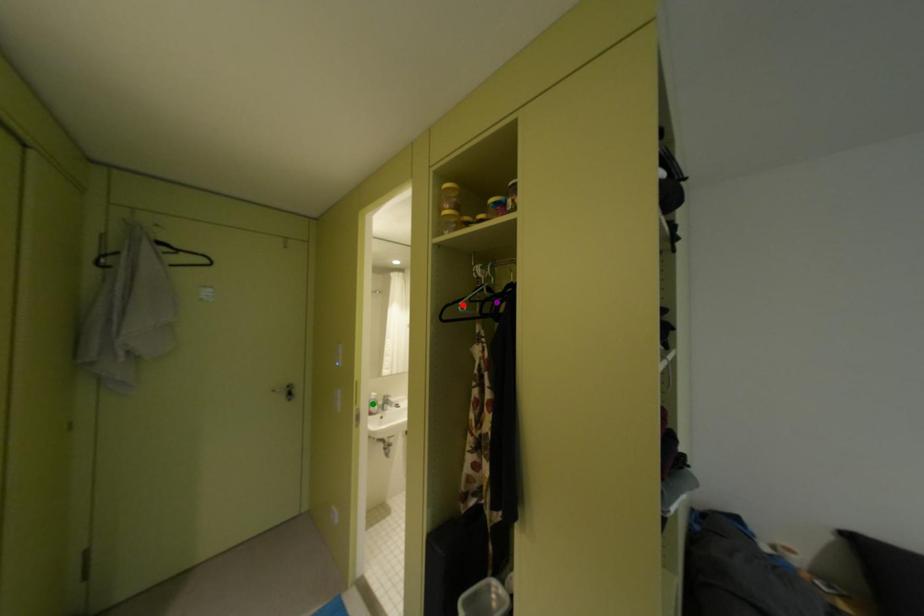
Order these from nearest to farthest:
A) red point
B) purple point
C) green point

red point, purple point, green point